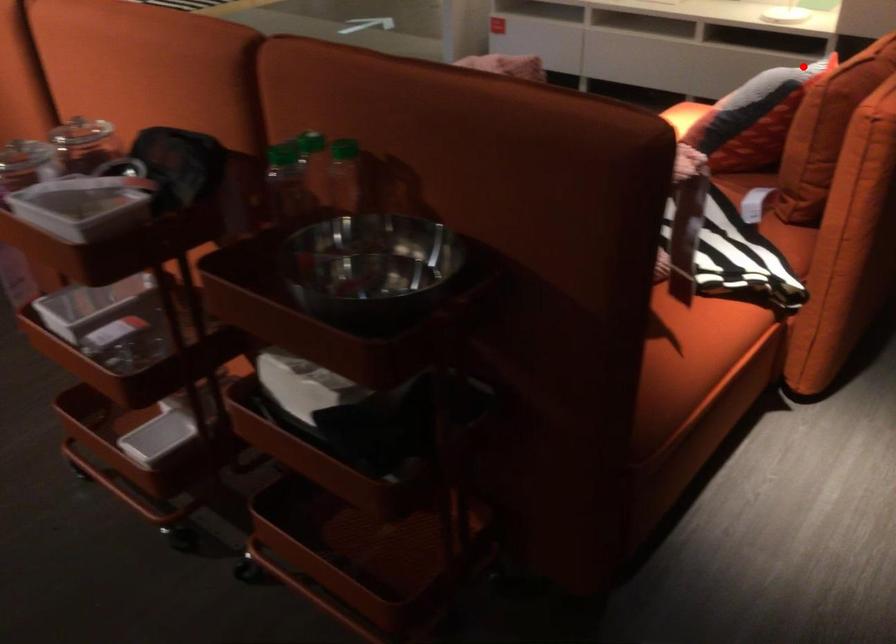
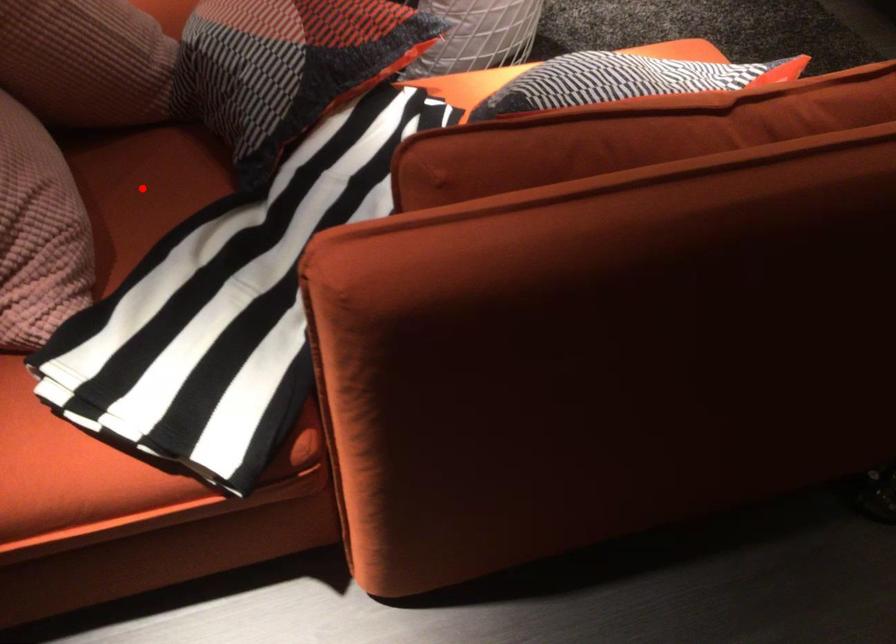
I am providing you with two images of the same scene from different viewpoints. A red point is marked on the first image and another point is marked on the second image. Does the point marked in image1 correspond to the same location as the one in image2?

No